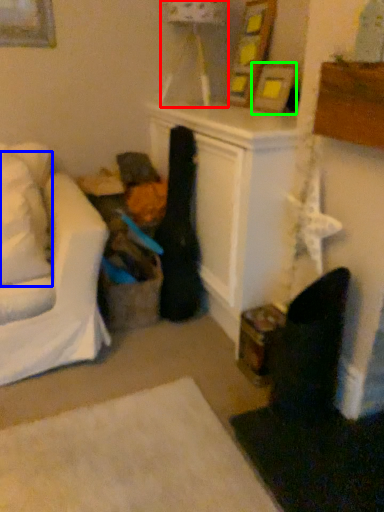
Question: Which is nearer to the lamp (highlighted by a red box)? pillow (highlighted by a blue box) or picture frame (highlighted by a green box).

Choices:
 (A) pillow
 (B) picture frame

Answer: (B)